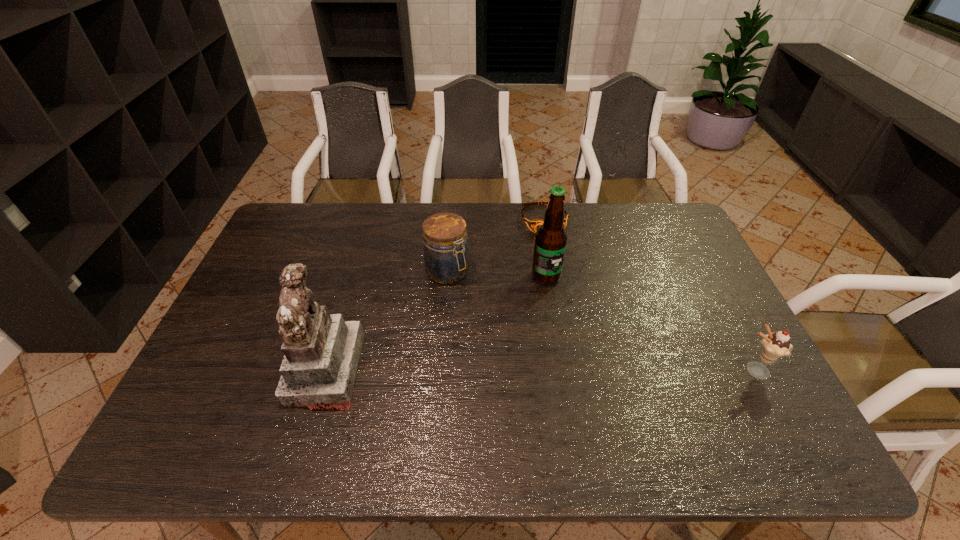
Locate an element on the screen. figurine present at the near edge is located at coordinates (321, 351).

The width and height of the screenshot is (960, 540). I want to click on icecream that is at the near edge, so click(x=774, y=346).

Where is `object present at the right edge`? object present at the right edge is located at coordinates (774, 346).

Locate an element on the screen. The width and height of the screenshot is (960, 540). object that is at the near right corner is located at coordinates (774, 346).

Locate an element on the screen. This screenshot has height=540, width=960. vacant space at the far edge of the desktop is located at coordinates (338, 227).

Where is `vacant space at the near edge`? The width and height of the screenshot is (960, 540). vacant space at the near edge is located at coordinates (703, 415).

Locate an element on the screen. vacant space at the left edge is located at coordinates (241, 369).

The height and width of the screenshot is (540, 960). In the image, there is a desktop. What are the coordinates of `free space at the right edge` in the screenshot? It's located at (730, 368).

Locate an element on the screen. The height and width of the screenshot is (540, 960). vacant area at the near left corner of the desktop is located at coordinates (232, 389).

Where is `vacant area at the far right corner of the desktop`? vacant area at the far right corner of the desktop is located at coordinates (681, 241).